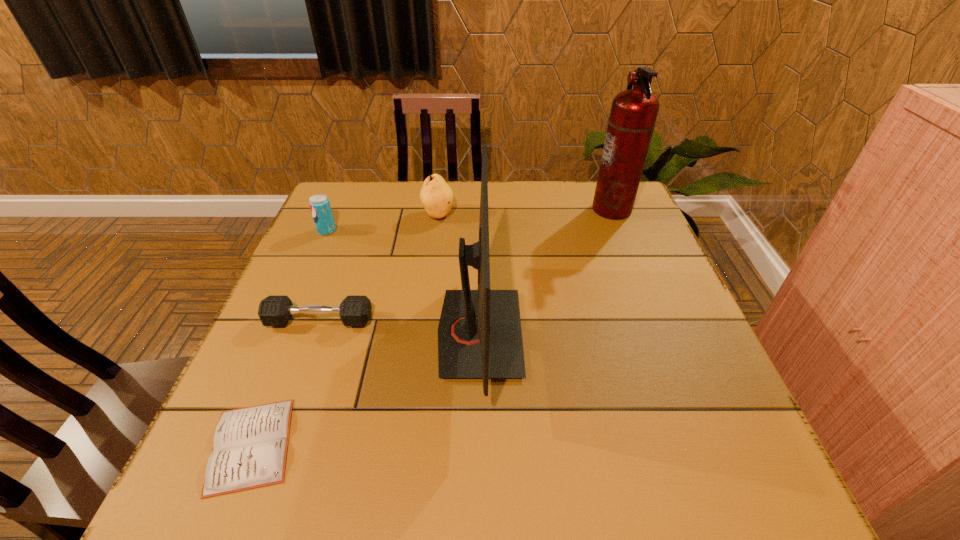
Find the location of a particular element. This screenshot has width=960, height=540. fire extinguisher is located at coordinates (633, 114).

Locate an element on the screen. the rightmost object is located at coordinates (633, 114).

I want to click on the second tallest object, so click(479, 335).

Where is `pear`? This screenshot has height=540, width=960. pear is located at coordinates (436, 195).

In order to click on the third shortest object in this screenshot , I will do `click(319, 204)`.

In order to click on soda can in this screenshot , I will do coord(319,204).

At what (x,y) coordinates should I click in order to perform the action: click on dumbbell. Please return your answer as a coordinate pair (x, y). This screenshot has height=540, width=960. Looking at the image, I should click on (273, 310).

Find the location of a particular element. The image size is (960, 540). diary is located at coordinates tap(250, 446).

Find the location of a particular element. The image size is (960, 540). vacant space located 0.130m on the nozzle side of the fire extinguisher is located at coordinates (548, 209).

The width and height of the screenshot is (960, 540). Find the location of `free spot located on the nozzle side of the fire extinguisher`. free spot located on the nozzle side of the fire extinguisher is located at coordinates (492, 209).